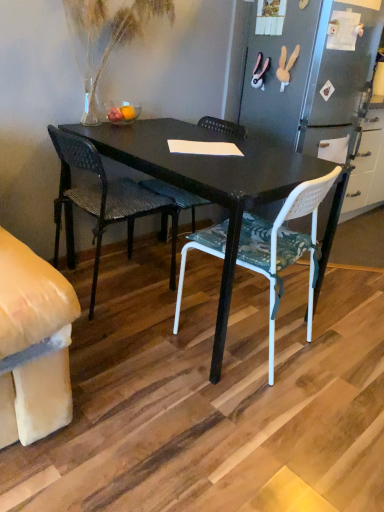
Question: Which direction should I rotate to look at woven dark brown chair at center, which ranks as the 1th chair in left-to-right order?

Choices:
 (A) right
 (B) left

Answer: (B)

Question: Can you confirm if woven dark brown chair at center, which ranks as the 1th chair in left-to-right order, is bigger than white plastic chair at center, the 2th chair in the left-to-right sequence?

Choices:
 (A) no
 (B) yes

Answer: (A)

Question: Does woven dark brown chair at center, which is the second chair in right-to-left order, have a greater height compared to white plastic chair at center, placed as the 1th chair when sorted from right to left?

Choices:
 (A) yes
 (B) no

Answer: (A)

Question: Is woven dark brown chair at center, which ranks as the 1th chair in left-to-right order, to the left of white plastic chair at center, placed as the 1th chair when sorted from right to left, from the viewer's perspective?

Choices:
 (A) no
 (B) yes

Answer: (B)

Question: From a real-world perspective, is woven dark brown chair at center, which ranks as the 1th chair in left-to-right order, on white plastic chair at center, placed as the 1th chair when sorted from right to left?

Choices:
 (A) no
 (B) yes

Answer: (A)

Question: Does woven dark brown chair at center, which ranks as the 1th chair in left-to-right order, have a lesser width compared to white plastic chair at center, placed as the 1th chair when sorted from right to left?

Choices:
 (A) no
 (B) yes

Answer: (B)

Question: Considering the relative positions of woven dark brown chair at center, which is the second chair in right-to-left order, and white plastic chair at center, placed as the 1th chair when sorted from right to left, in the image provided, is woven dark brown chair at center, which is the second chair in right-to-left order, to the right of white plastic chair at center, placed as the 1th chair when sorted from right to left, from the viewer's perspective?

Choices:
 (A) no
 (B) yes

Answer: (A)

Question: Considering the relative sizes of translucent glass vase at upper left and woven dark brown chair at center, which is the second chair in right-to-left order, in the image provided, is translucent glass vase at upper left shorter than woven dark brown chair at center, which is the second chair in right-to-left order,?

Choices:
 (A) no
 (B) yes

Answer: (B)

Question: Is woven dark brown chair at center, which is the second chair in right-to-left order, at the back of translucent glass vase at upper left?

Choices:
 (A) no
 (B) yes

Answer: (A)

Question: From the image's perspective, is translucent glass vase at upper left beneath woven dark brown chair at center, which ranks as the 1th chair in left-to-right order?

Choices:
 (A) no
 (B) yes

Answer: (A)

Question: Is translucent glass vase at upper left completely or partially outside of woven dark brown chair at center, which ranks as the 1th chair in left-to-right order?

Choices:
 (A) yes
 (B) no

Answer: (A)

Question: Considering the relative positions of translucent glass vase at upper left and woven dark brown chair at center, which is the second chair in right-to-left order, in the image provided, is translucent glass vase at upper left to the left of woven dark brown chair at center, which is the second chair in right-to-left order, from the viewer's perspective?

Choices:
 (A) yes
 (B) no

Answer: (B)

Question: Does translucent glass vase at upper left have a lesser width compared to woven dark brown chair at center, which is the second chair in right-to-left order?

Choices:
 (A) yes
 (B) no

Answer: (A)

Question: From the image's perspective, is white plastic chair at center, placed as the 1th chair when sorted from right to left, over translucent glass vase at upper left?

Choices:
 (A) no
 (B) yes

Answer: (A)